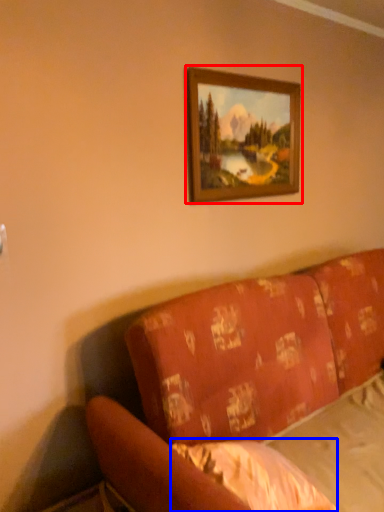
Question: Which point is closer to the camera, picture frame (highlighted by a red box) or sheet (highlighted by a blue box)?

Choices:
 (A) picture frame
 (B) sheet

Answer: (B)